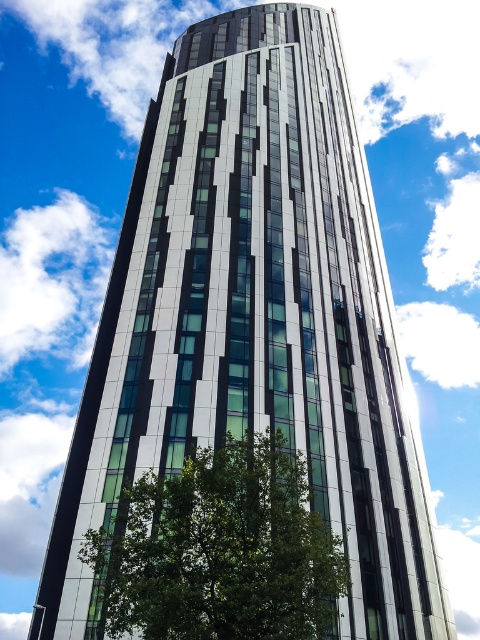
Question: Is white fluffy cloud at upper left to the right of white fluffy cloud at upper center from the viewer's perspective?

Choices:
 (A) no
 (B) yes

Answer: (A)

Question: Is white fluffy cloud at upper left above white fluffy cloud at upper center?

Choices:
 (A) yes
 (B) no

Answer: (A)

Question: Which of the following is the closest to the observer?

Choices:
 (A) green leafy tree at lower center
 (B) white fluffy cloud at upper left
 (C) white fluffy cloud at upper center

Answer: (A)

Question: Which point is closer to the camera taking this photo?

Choices:
 (A) (9, 294)
 (B) (400, 333)

Answer: (B)

Question: Can you confirm if white fluffy cloud at upper left is positioned above white fluffy cloud at upper center?

Choices:
 (A) yes
 (B) no

Answer: (A)

Question: Which object appears farthest from the camera in this image?

Choices:
 (A) white fluffy cloud at upper left
 (B) green leafy tree at lower center
 (C) white fluffy cloud at upper center

Answer: (A)